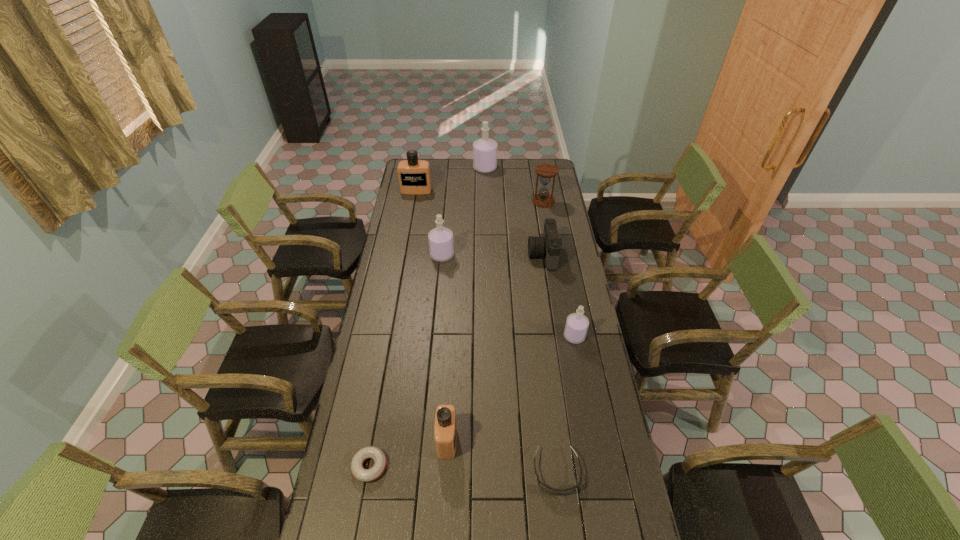
This screenshot has width=960, height=540. Find the location of `perfume situated at the right edge`. perfume situated at the right edge is located at coordinates click(576, 327).

Where is `camera positioned at the right edge`? This screenshot has width=960, height=540. camera positioned at the right edge is located at coordinates (548, 246).

I want to click on goggles that is at the right edge, so click(551, 490).

Image resolution: width=960 pixels, height=540 pixels. Find the location of `free spot at the far edge of the desktop`. free spot at the far edge of the desktop is located at coordinates (458, 159).

Where is `blank space at the left edge`? This screenshot has width=960, height=540. blank space at the left edge is located at coordinates (420, 240).

This screenshot has width=960, height=540. In order to click on free region at the right edge of the desktop in this screenshot , I will do `click(636, 530)`.

Locate an element on the screen. Image resolution: width=960 pixels, height=540 pixels. free space between the hourglass and the rightmost perfume is located at coordinates (559, 269).

Find the location of a particular element. The image size is (960, 540). free space that is in between the seventh nearest object and the eighth tallest object is located at coordinates (550, 336).

Where is `vacant area that lies between the left beige perfume and the hourglass`? This screenshot has width=960, height=540. vacant area that lies between the left beige perfume and the hourglass is located at coordinates (480, 196).

The height and width of the screenshot is (540, 960). I want to click on vacant space that's between the second purple perfume from left to right and the seventh tallest object, so click(x=514, y=212).